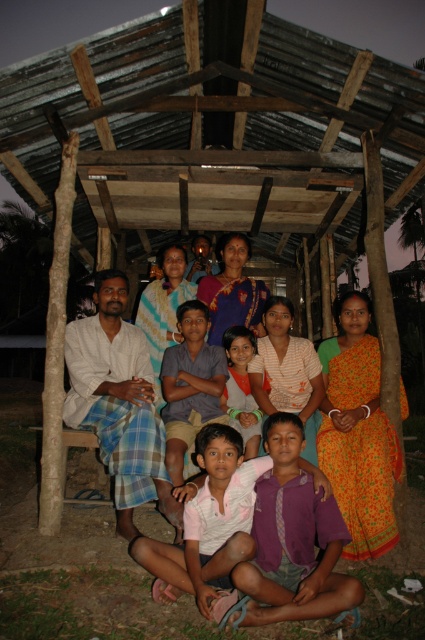
In the scene shown: You are standing in front of the wooden structure and see two people wearing shirts at the center. Which shirt is closer to you, the purple cotton shirt at center or the orange cotton shirt at center?

The purple cotton shirt at center is closer to the viewer than the orange cotton shirt at center.

From the picture: You are organizing a group photo and need to arrange the purple cotton shirt at center and orange cotton shirt at center so that they fit side by side without overlapping. Given the space available, which shirt should be placed first to ensure they both fit?

The purple cotton shirt at center is wider than the orange cotton shirt at center. To fit them side by side without overlapping, place the wider purple cotton shirt at center first, then position the narrower orange cotton shirt at center next to it.

You are standing at the point labeled point (257, 428) and want to move to the point labeled point (235, 432). Which direction should you move in to reach your destination?

You should move forward because point (235, 432) is in front of point (257, 428).